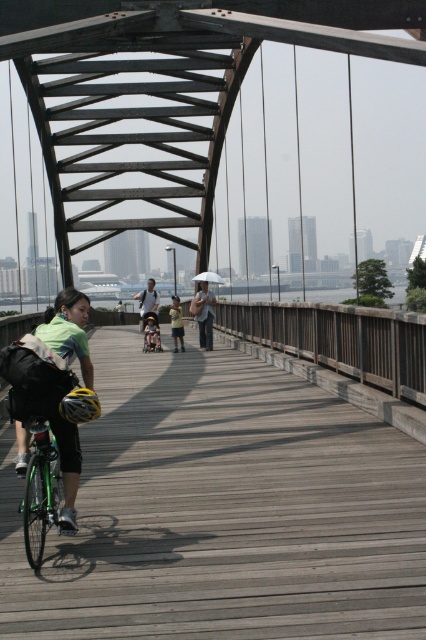
You are standing on the wooden pedestrian bridge and see two points marked on the bridge. The first point is at coordinates point (x=275, y=404) and the second point is at point (x=210, y=326). Which point is closer to you as you face the bridge?

Point (x=275, y=404) is in front of point (x=210, y=326), so it is closer to you as you face the bridge.